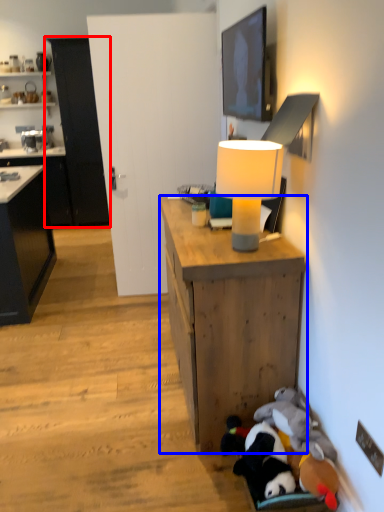
Question: Which object is closer to the camera taking this photo, cabinetry (highlighted by a red box) or desk (highlighted by a blue box)?

Choices:
 (A) cabinetry
 (B) desk

Answer: (B)